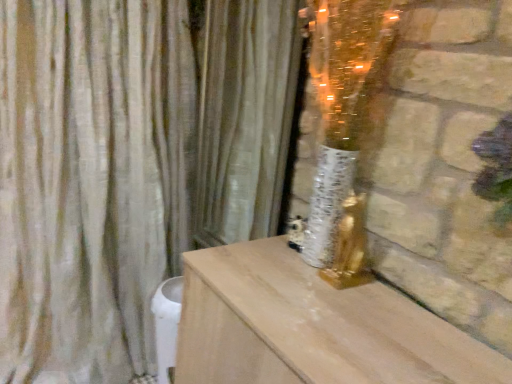
Question: Is silky beige curtain at center, placed as the second curtain when sorted from left to right, to the left or to the right of beige fabric curtain at left, the first curtain viewed from the left, in the image?

Choices:
 (A) left
 (B) right

Answer: (B)

Question: Is silky beige curtain at center, placed as the second curtain when sorted from left to right, wider or thinner than beige fabric curtain at left, which appears as the second curtain when viewed from the right?

Choices:
 (A) wide
 (B) thin

Answer: (B)

Question: Is silky beige curtain at center, placed as the second curtain when sorted from left to right, situated inside beige fabric curtain at left, which appears as the second curtain when viewed from the right, or outside?

Choices:
 (A) inside
 (B) outside

Answer: (B)

Question: Relative to silky beige curtain at center, placed as the second curtain when sorted from left to right, is beige fabric curtain at left, the first curtain viewed from the left, in front or behind?

Choices:
 (A) front
 (B) behind

Answer: (A)

Question: Considering the positions of beige fabric curtain at left, which appears as the second curtain when viewed from the right, and silky beige curtain at center, placed as the second curtain when sorted from left to right, in the image, is beige fabric curtain at left, which appears as the second curtain when viewed from the right, taller or shorter than silky beige curtain at center, placed as the second curtain when sorted from left to right,?

Choices:
 (A) tall
 (B) short

Answer: (A)

Question: From the image's perspective, is beige fabric curtain at left, the first curtain viewed from the left, located above or below silky beige curtain at center, which is counted as the 1th curtain, starting from the right?

Choices:
 (A) above
 (B) below

Answer: (B)

Question: Considering the positions of beige fabric curtain at left, the first curtain viewed from the left, and silky beige curtain at center, placed as the second curtain when sorted from left to right, in the image, is beige fabric curtain at left, the first curtain viewed from the left, wider or thinner than silky beige curtain at center, placed as the second curtain when sorted from left to right,?

Choices:
 (A) thin
 (B) wide

Answer: (B)